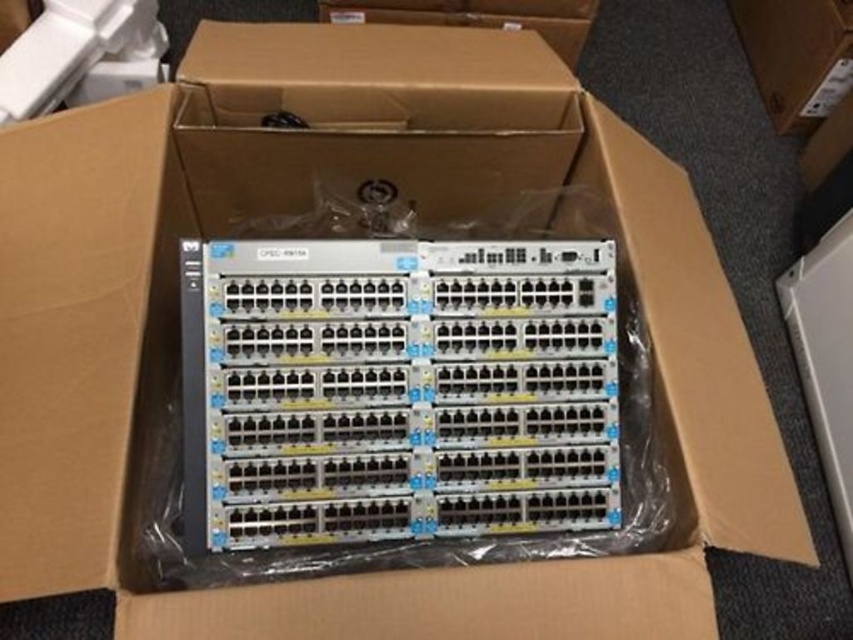
Question: Which point is farther from the camera taking this photo?

Choices:
 (A) (453, 12)
 (B) (817, 58)

Answer: (B)

Question: Does cardboard box at center have a lesser width compared to brown cardboard box at upper center?

Choices:
 (A) no
 (B) yes

Answer: (B)

Question: Can you confirm if cardboard box at center is smaller than brown cardboard box at upper center?

Choices:
 (A) no
 (B) yes

Answer: (A)

Question: Does cardboard box at center have a larger size compared to brown cardboard box at upper center?

Choices:
 (A) yes
 (B) no

Answer: (A)

Question: Which point appears closest to the camera in this image?

Choices:
 (A) (538, 13)
 (B) (761, 65)

Answer: (A)